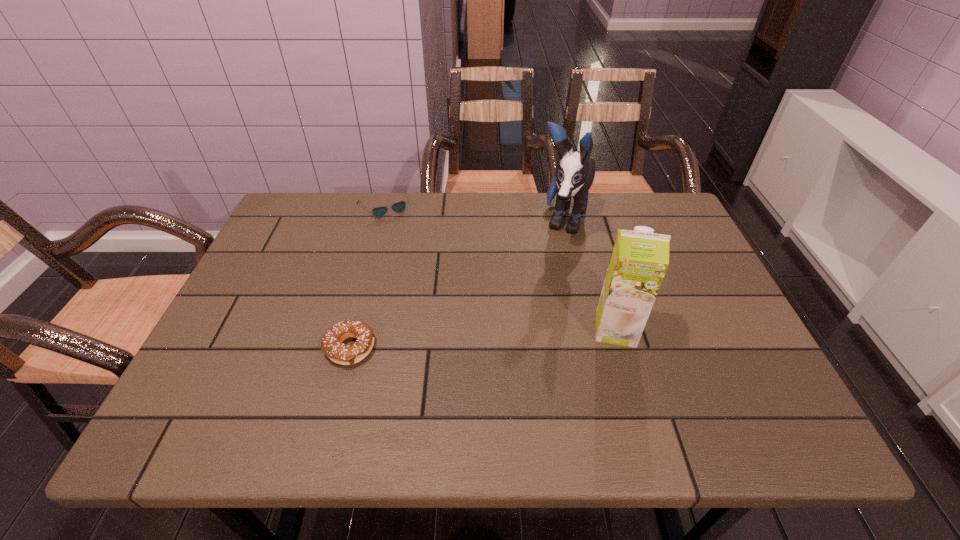
At what (x,y) coordinates should I click in order to perform the action: click on blank region between the soya milk and the puppy. Please return your answer as a coordinate pair (x, y). Looking at the image, I should click on (589, 275).

Locate an element on the screen. The height and width of the screenshot is (540, 960). the second closest object to the sunglasses is located at coordinates (331, 344).

Locate which object ranks third in proximity to the sunglasses. Please provide its 2D coordinates. Your answer should be formatted as a tuple, i.e. [(x, y)], where the tuple contains the x and y coordinates of a point satisfying the conditions above.

[(639, 260)]